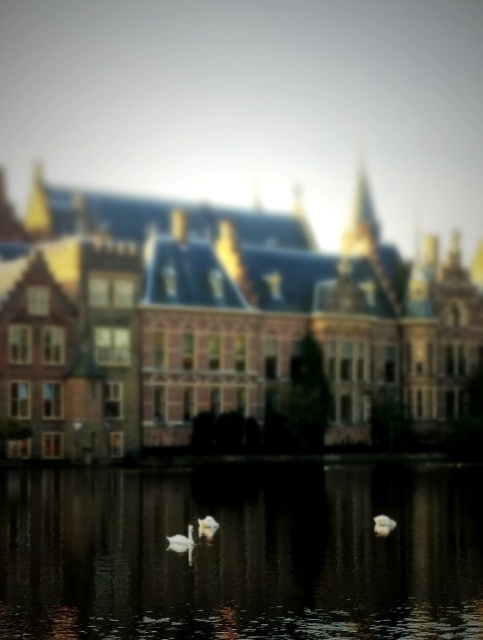
Question: Among these objects, which one is farthest from the camera?

Choices:
 (A) white fluffy swan at center
 (B) smooth reflective water at center

Answer: (A)

Question: In this image, where is white fluffy swan at center located relative to white matte swan at center?

Choices:
 (A) right
 (B) left

Answer: (A)

Question: Is white fluffy swan at center wider than white matte swan at center?

Choices:
 (A) no
 (B) yes

Answer: (A)

Question: Does white feathered swan at center have a larger size compared to white matte swan at center?

Choices:
 (A) no
 (B) yes

Answer: (B)

Question: Estimate the real-world distances between objects in this image. Which object is closer to the white feathered swan at center?

Choices:
 (A) white matte swan at center
 (B) brown brick palace at center

Answer: (A)

Question: Which point appears closest to the camera in this image?

Choices:
 (A) (190, 548)
 (B) (28, 260)
 (C) (315, 486)
 (D) (384, 518)

Answer: (A)